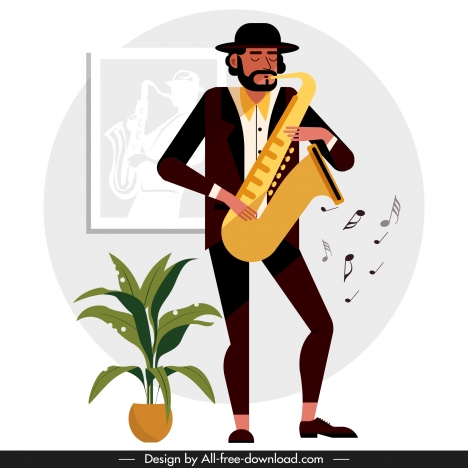
Locate an element on the screen. This screenshot has width=468, height=468. faded framed image on back wall is located at coordinates (144, 128).